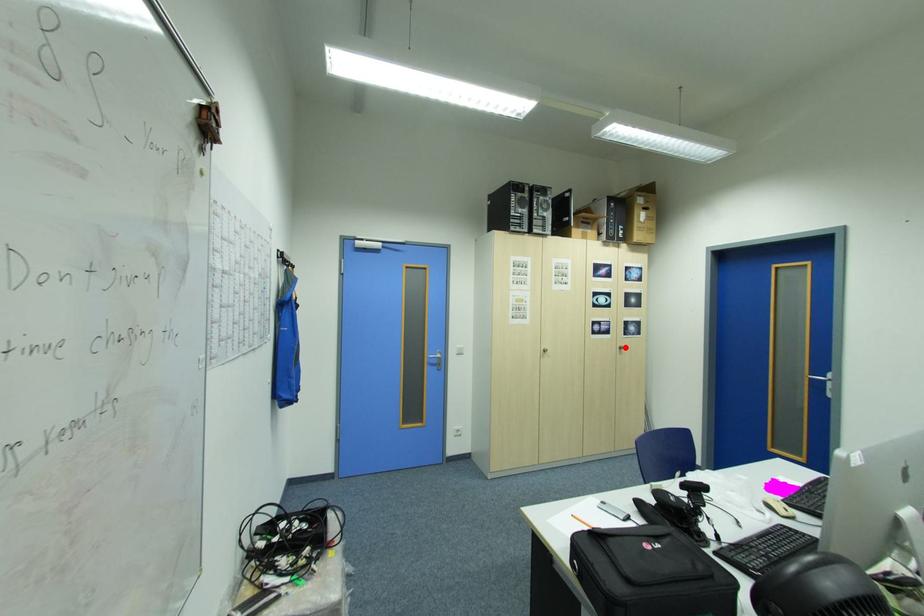
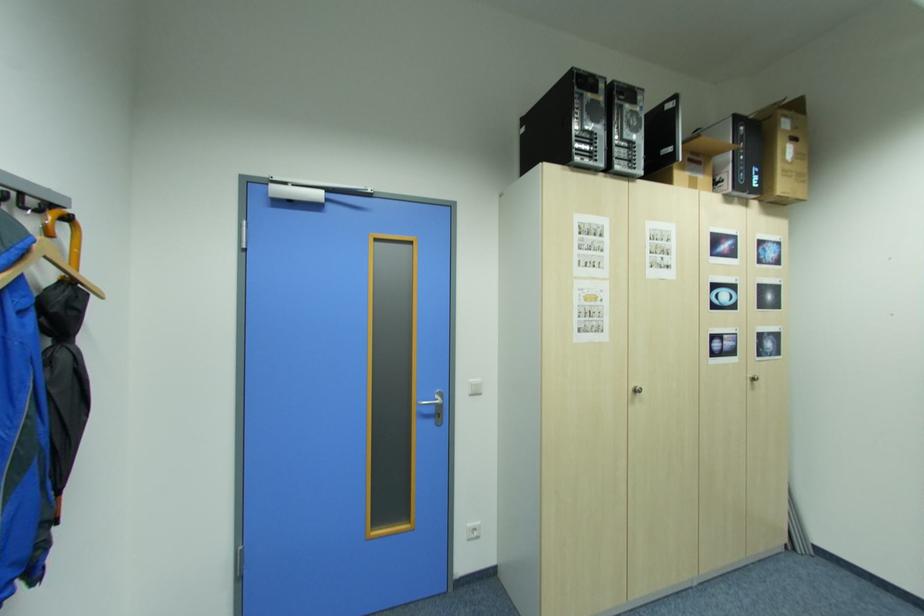
Find the pixel in the second image that matches the highlighted location in the first image.

(756, 378)